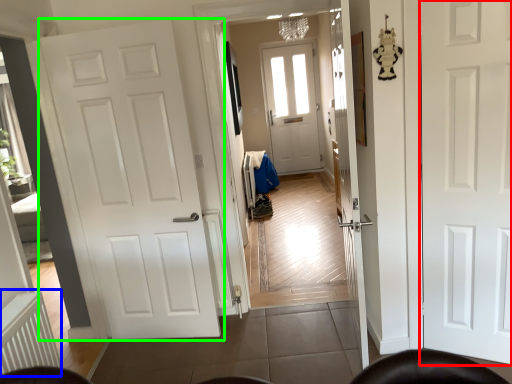
Question: Which is nearer to the door (highlighted by a red box)? radiator (highlighted by a blue box) or door (highlighted by a green box).

Choices:
 (A) radiator
 (B) door

Answer: (B)